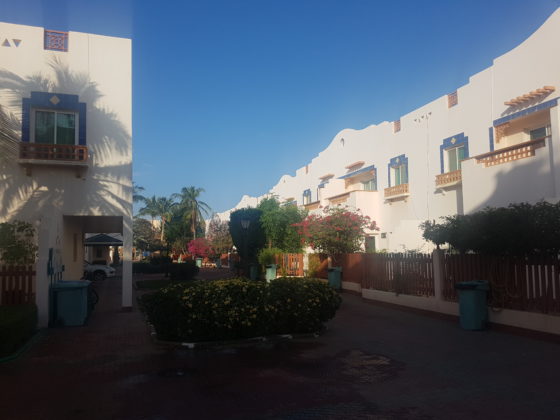
Where is `windows`? windows is located at coordinates (398, 176), (448, 158), (44, 129).